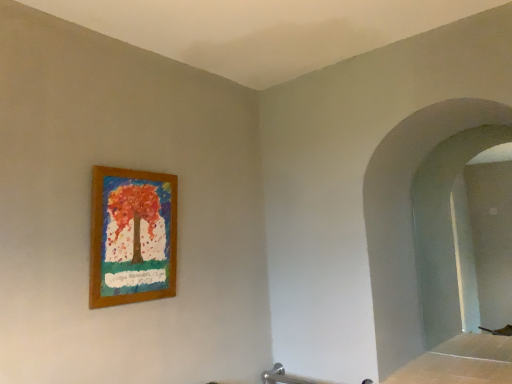
The height and width of the screenshot is (384, 512). I want to click on wooden frame at upper left, so click(x=132, y=236).

The image size is (512, 384). What do you see at coordinates (132, 236) in the screenshot?
I see `wooden frame at upper left` at bounding box center [132, 236].

Measure the distance between wooden frame at upper left and camera.

5.24 feet.

I want to click on wooden frame at upper left, so click(132, 236).